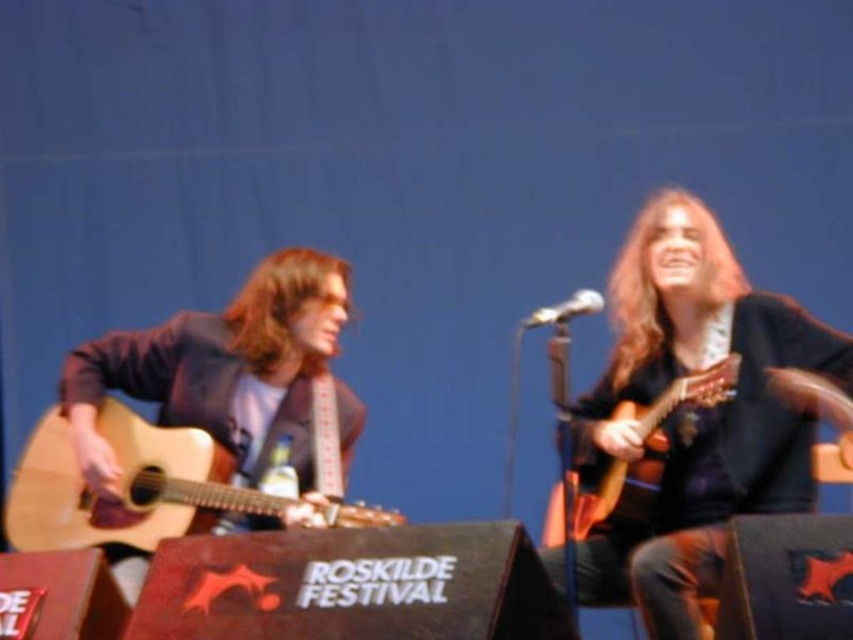
You are a photographer at the Roskilde Festival. You need to capture a photo where both the matte black guitar at right and the matte brown guitar at left are visible. Based on their positions, which guitar should you focus on first to ensure both are in frame?

The matte black guitar at right is below the matte brown guitar at left, so you should focus on the matte brown guitar at left first to ensure both guitars are within the frame.

You are a photographer at the Roskilde Festival and want to capture a clear shot of both the matte brown guitar at left and the wooden acoustic guitar at right. Given their positions, which guitar will appear closer to the camera in your photo?

The matte brown guitar at left will appear closer to the camera because the wooden acoustic guitar at right is behind it.